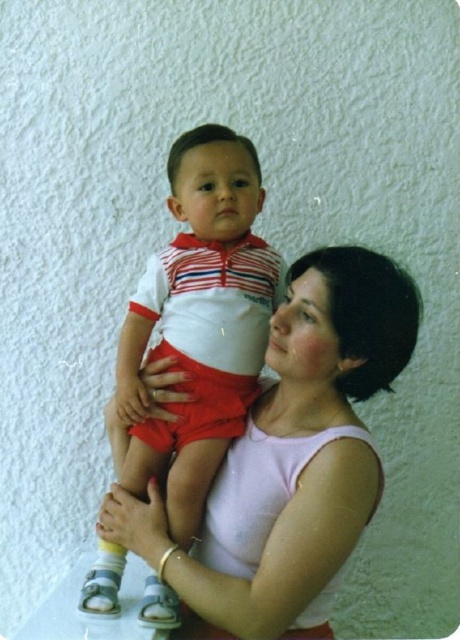
Can you confirm if pink fabric shirt at center is bigger than matte white and red striped shirt at center?

Correct, pink fabric shirt at center is larger in size than matte white and red striped shirt at center.

Does point (295, 314) come in front of point (246, 253)?

Yes, it is.

In order to click on pink fabric shirt at center in this screenshot , I will do `click(291, 456)`.